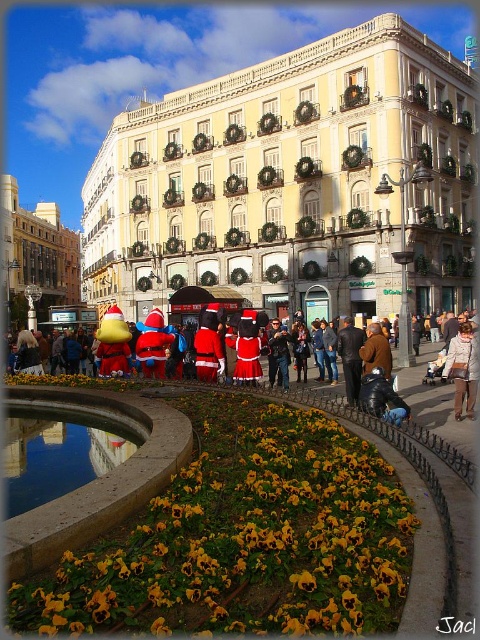
Question: Which point is farther to the camera?

Choices:
 (A) (469, 365)
 (B) (396, 545)
 (C) (362, 353)

Answer: (C)

Question: Can you confirm if light brown leather jacket at lower right is thinner than brown leather jacket at center?

Choices:
 (A) yes
 (B) no

Answer: (B)

Question: Considering the real-world distances, which object is farthest from the brown leather jacket at center?

Choices:
 (A) santa costume at center
 (B) light brown leather jacket at lower right
 (C) dark blue leather jacket at lower center
 (D) yellow matte flower at lower center

Answer: (D)

Question: Is dark blue leather jacket at lower center positioned at the back of brown leather jacket at center?

Choices:
 (A) no
 (B) yes

Answer: (A)

Question: Observing the image, what is the correct spatial positioning of yellow matte flower at lower center in reference to light brown leather jacket at lower right?

Choices:
 (A) above
 (B) below

Answer: (B)

Question: Which point is closer to the camera?

Choices:
 (A) dark blue leather jacket at lower center
 (B) light brown leather jacket at lower right
 (C) yellow matte flower at lower center
 (D) brown leather jacket at center

Answer: (C)